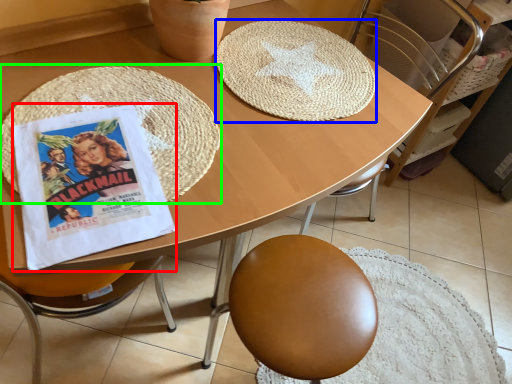
Question: Which object is the farthest from comic book (highlighted by a red box)? Choose among these: mat (highlighted by a blue box) or mat (highlighted by a green box).

Choices:
 (A) mat
 (B) mat

Answer: (A)